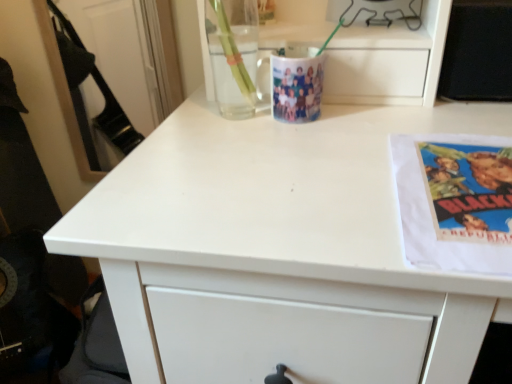
Measure the distance between transparent glass mug at upper center and camera.

transparent glass mug at upper center and camera are 24.43 inches apart from each other.

I want to click on metallic wire at upper center, so click(376, 12).

Considering the relative sizes of metallic wire at upper center and white paper at right in the image provided, is metallic wire at upper center shorter than white paper at right?

Incorrect, the height of metallic wire at upper center does not fall short of that of white paper at right.

Find the location of a particular element. Image resolution: width=512 pixels, height=384 pixels. paperback book in front of the metallic wire at upper center is located at coordinates (469, 191).

Is metallic wire at upper center smaller than white paper at right?

Actually, metallic wire at upper center might be larger than white paper at right.

Does point (396, 4) come behind point (490, 156)?

Yes.

What's the angular difference between transparent glass mug at upper center and metallic wire at upper center's facing directions?

They differ by 0.642 degrees in their facing directions.

Can you confirm if transparent glass mug at upper center is taller than metallic wire at upper center?

Incorrect, the height of transparent glass mug at upper center is not larger of that of metallic wire at upper center.

Is transparent glass mug at upper center spatially inside metallic wire at upper center, or outside of it?

transparent glass mug at upper center cannot be found inside metallic wire at upper center.

Is transparent glass mug at upper center smaller than metallic wire at upper center?

Indeed, transparent glass mug at upper center has a smaller size compared to metallic wire at upper center.

From the image's perspective, which is below, metallic wire at upper center or transparent glass mug at upper center?

transparent glass mug at upper center is shown below in the image.

Is the depth of metallic wire at upper center less than that of transparent glass mug at upper center?

No, metallic wire at upper center is further to the viewer.

How different are the orientations of metallic wire at upper center and transparent glass mug at upper center in degrees?

The facing directions of metallic wire at upper center and transparent glass mug at upper center are 0.642 degrees apart.

Which is more to the right, transparent glass mug at upper center or white paper at right?

white paper at right.

From a real-world perspective, which is physically above, transparent glass mug at upper center or white paper at right?

In real-world perspective, transparent glass mug at upper center is above.

Is transparent glass mug at upper center oriented towards white paper at right?

No, transparent glass mug at upper center is not turned towards white paper at right.

How different are the orientations of transparent glass mug at upper center and white paper at right in degrees?

The facing directions of transparent glass mug at upper center and white paper at right are 0.698 degrees apart.

Between white paper at right and transparent glass mug at upper center, which one has larger size?

Bigger between the two is white paper at right.

Is white paper at right surrounding transparent glass mug at upper center?

No.

In the scene shown: Is white paper at right far away from transparent glass mug at upper center?

white paper at right is near transparent glass mug at upper center, not far away.

From a real-world perspective, is white paper at right above or below transparent glass mug at upper center?

Clearly, from a real-world perspective, white paper at right is below transparent glass mug at upper center.

Is white paper at right placed right next to metallic wire at upper center?

No.

Is point (473, 149) behind point (379, 10)?

No, (473, 149) is closer to viewer.

Would you say white paper at right is outside metallic wire at upper center?

Yes.

The height and width of the screenshot is (384, 512). Find the location of `appliance lying above the white paper at right (from the image's perspective)`. appliance lying above the white paper at right (from the image's perspective) is located at coordinates coord(376,12).

At what (x,y) coordinates should I click in order to perform the action: click on appliance behind the transparent glass mug at upper center. Please return your answer as a coordinate pair (x, y). Looking at the image, I should click on tap(376, 12).

Based on their spatial positions, is white paper at right or metallic wire at upper center closer to transparent glass mug at upper center?

metallic wire at upper center.

Considering their positions, is metallic wire at upper center positioned closer to white paper at right than transparent glass mug at upper center?

The object closer to white paper at right is transparent glass mug at upper center.

When comparing their distances from metallic wire at upper center, does transparent glass mug at upper center or white paper at right seem further?

white paper at right is further to metallic wire at upper center.

From the image, which object appears to be farther from transparent glass mug at upper center, metallic wire at upper center or white paper at right?

white paper at right is further to transparent glass mug at upper center.

From the image, which object appears to be nearer to white paper at right, transparent glass mug at upper center or metallic wire at upper center?

transparent glass mug at upper center.

Looking at the image, which one is located closer to metallic wire at upper center, white paper at right or transparent glass mug at upper center?

Based on the image, transparent glass mug at upper center appears to be nearer to metallic wire at upper center.

Find the location of a particular element. The image size is (512, 384). mug between metallic wire at upper center and white paper at right in the vertical direction is located at coordinates (296, 87).